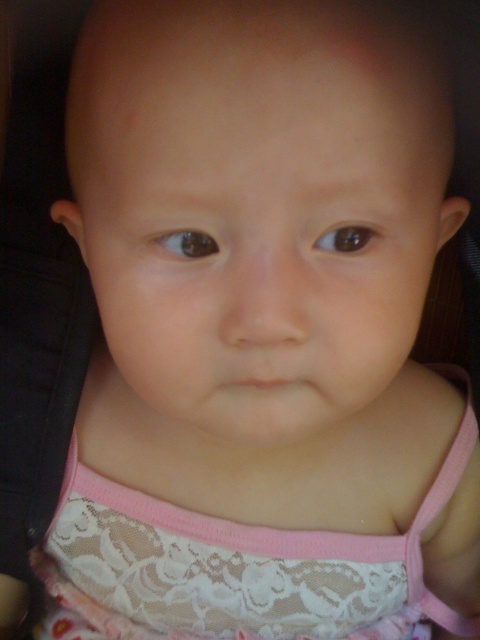
Which of these two, lace fabric dress at center or pink fabric strap at center, stands taller?

pink fabric strap at center is taller.

Which is above, lace fabric dress at center or pink fabric strap at center?

pink fabric strap at center

Who is more distant from viewer, (375, 621) or (427, 500)?

The point (375, 621) is behind.

This screenshot has width=480, height=640. Find the location of `lace fabric dress at center`. lace fabric dress at center is located at coordinates (235, 566).